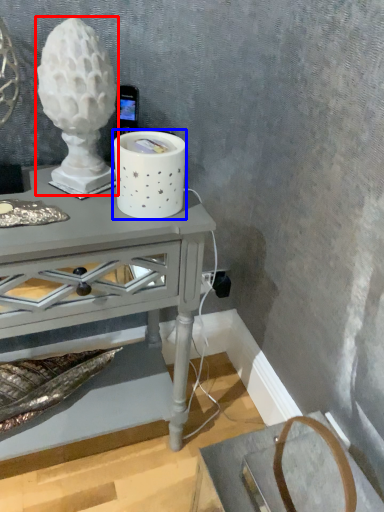
Question: Among these objects, which one is nearest to the camera, candle holder (highlighted by a red box) or candle holder (highlighted by a blue box)?

Choices:
 (A) candle holder
 (B) candle holder

Answer: (A)